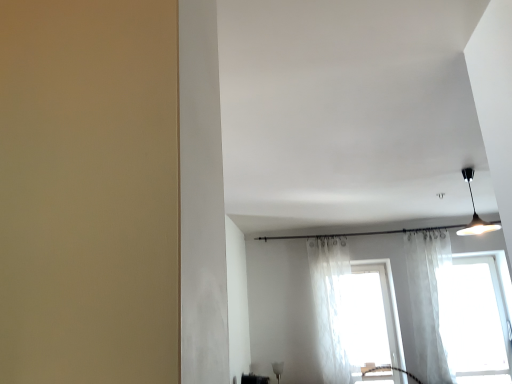
Question: Does black glossy shelf at lower center have a smaller size compared to translucent white curtain at center, the first curtain from the left?

Choices:
 (A) yes
 (B) no

Answer: (A)

Question: Can you confirm if black glossy shelf at lower center is positioned to the right of translucent white curtain at center, the first curtain from the left?

Choices:
 (A) yes
 (B) no

Answer: (B)

Question: From the image's perspective, is black glossy shelf at lower center located beneath translucent white curtain at center, the second curtain positioned from the right?

Choices:
 (A) no
 (B) yes

Answer: (B)

Question: Considering the relative sizes of black glossy shelf at lower center and translucent white curtain at center, the first curtain from the left, in the image provided, is black glossy shelf at lower center thinner than translucent white curtain at center, the first curtain from the left,?

Choices:
 (A) yes
 (B) no

Answer: (A)

Question: Is black glossy shelf at lower center taller than translucent white curtain at center, the first curtain from the left?

Choices:
 (A) yes
 (B) no

Answer: (B)

Question: Is black matte pendant light at upper right to the left or to the right of white sheer curtain at right, the 1th curtain when ordered from right to left, in the image?

Choices:
 (A) left
 (B) right

Answer: (A)

Question: From a real-world perspective, relative to white sheer curtain at right, which ranks as the 2th curtain in left-to-right order, is black matte pendant light at upper right vertically above or below?

Choices:
 (A) above
 (B) below

Answer: (A)

Question: Is black matte pendant light at upper right spatially inside white sheer curtain at right, the 1th curtain when ordered from right to left, or outside of it?

Choices:
 (A) outside
 (B) inside

Answer: (A)

Question: From the image's perspective, is black matte pendant light at upper right positioned above or below white sheer curtain at right, the 1th curtain when ordered from right to left?

Choices:
 (A) below
 (B) above

Answer: (B)

Question: Is black glossy shelf at lower center to the left or to the right of translucent fabric window at center, placed as the 1th window when sorted from left to right, in the image?

Choices:
 (A) left
 (B) right

Answer: (A)

Question: Is black glossy shelf at lower center wider or thinner than translucent fabric window at center, placed as the 1th window when sorted from left to right?

Choices:
 (A) wide
 (B) thin

Answer: (B)

Question: From the image's perspective, relative to translucent fabric window at center, arranged as the second window when viewed from the right, is black glossy shelf at lower center above or below?

Choices:
 (A) below
 (B) above

Answer: (A)

Question: Is point (241, 375) closer or farther from the camera than point (348, 301)?

Choices:
 (A) farther
 (B) closer

Answer: (B)

Question: Looking at the image, does translucent fabric window at center, arranged as the second window when viewed from the right, seem bigger or smaller compared to transparent fabric window at right, arranged as the first window when viewed from the right?

Choices:
 (A) small
 (B) big

Answer: (B)

Question: Is point (374, 329) positioned closer to the camera than point (477, 324)?

Choices:
 (A) farther
 (B) closer

Answer: (A)